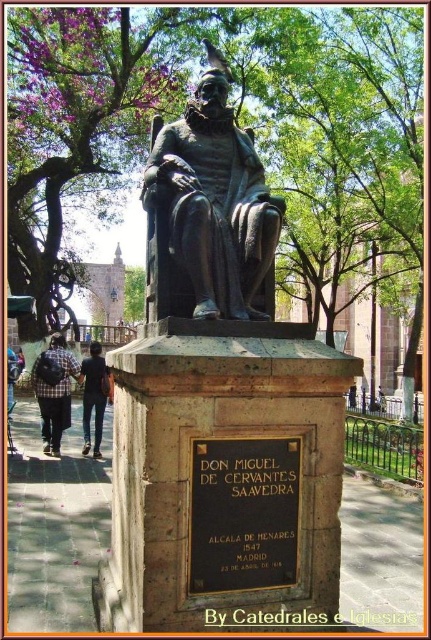
Looking at this image, can you confirm if green leafy tree at upper center is positioned to the left of dark blue jeans at lower left?

Indeed, green leafy tree at upper center is positioned on the left side of dark blue jeans at lower left.

In the scene shown: Between green leafy tree at upper center and dark blue jeans at lower left, which one appears on the right side from the viewer's perspective?

From the viewer's perspective, dark blue jeans at lower left appears more on the right side.

The image size is (431, 640). In order to click on green leafy tree at upper center in this screenshot , I will do `click(84, 118)`.

Can you confirm if bronze statue at center is positioned above dark blue jeans at lower left?

Correct, bronze statue at center is located above dark blue jeans at lower left.

This screenshot has height=640, width=431. Identify the location of bronze statue at center. (212, 202).

Between green leafy tree at upper center and plaid fabric backpack at lower left, which one is positioned higher?

Positioned higher is green leafy tree at upper center.

Is point (65, 90) positioned before point (53, 378)?

No.

The height and width of the screenshot is (640, 431). In order to click on green leafy tree at upper center in this screenshot , I will do `click(84, 118)`.